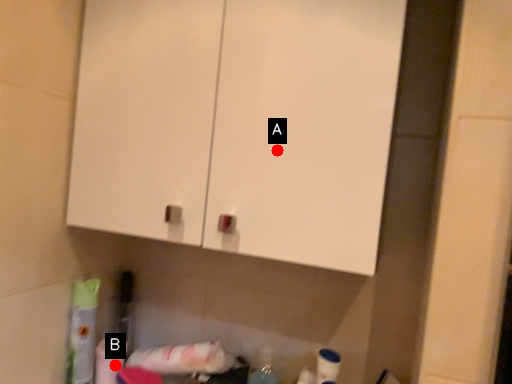
Question: Two points are circled on the image, labeled by A and B beside each circle. Which point is closer to the camera?

Choices:
 (A) A is closer
 (B) B is closer

Answer: (A)